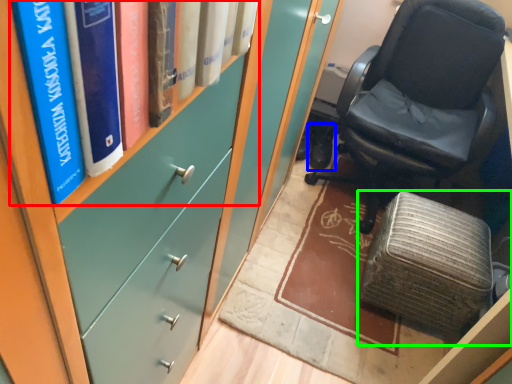
Question: Which object is positioned closest to book (highlighted by a red box)? Select from footwear (highlighted by a blue box) and furniture (highlighted by a green box).

Choices:
 (A) footwear
 (B) furniture

Answer: (B)